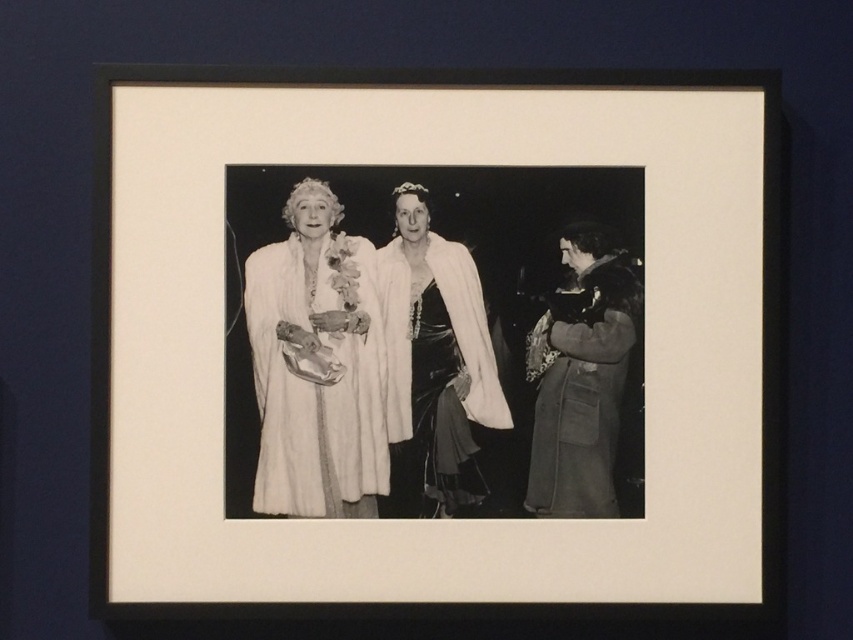
Can you confirm if black matte picture frame at center is taller than velvet brown coat at right?

Yes, black matte picture frame at center is taller than velvet brown coat at right.

Does black matte picture frame at center have a lesser height compared to velvet brown coat at right?

Incorrect, black matte picture frame at center's height does not fall short of velvet brown coat at right's.

Is point (451, 321) positioned behind point (606, 468)?

Yes, it is.

I want to click on black matte picture frame at center, so click(434, 342).

Does point (300, 202) come closer to viewer compared to point (424, 484)?

Yes, point (300, 202) is in front of point (424, 484).

Is point (276, 253) positioned after point (424, 262)?

No, (276, 253) is in front of (424, 262).

The height and width of the screenshot is (640, 853). I want to click on white fur coat at center, so click(317, 365).

Is black matte picture frame at center behind velvet black dress at center?

No, black matte picture frame at center is in front of velvet black dress at center.

Is point (747, 330) closer to viewer compared to point (405, 417)?

That is True.

Image resolution: width=853 pixels, height=640 pixels. Identify the location of black matte picture frame at center. (434, 342).